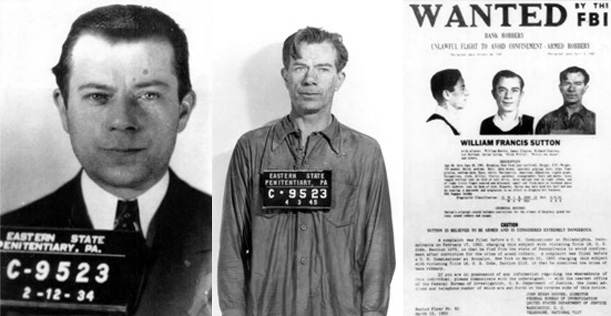
The width and height of the screenshot is (611, 316). Find the location of `chin of leftmost portrait`. chin of leftmost portrait is located at coordinates (125, 181).